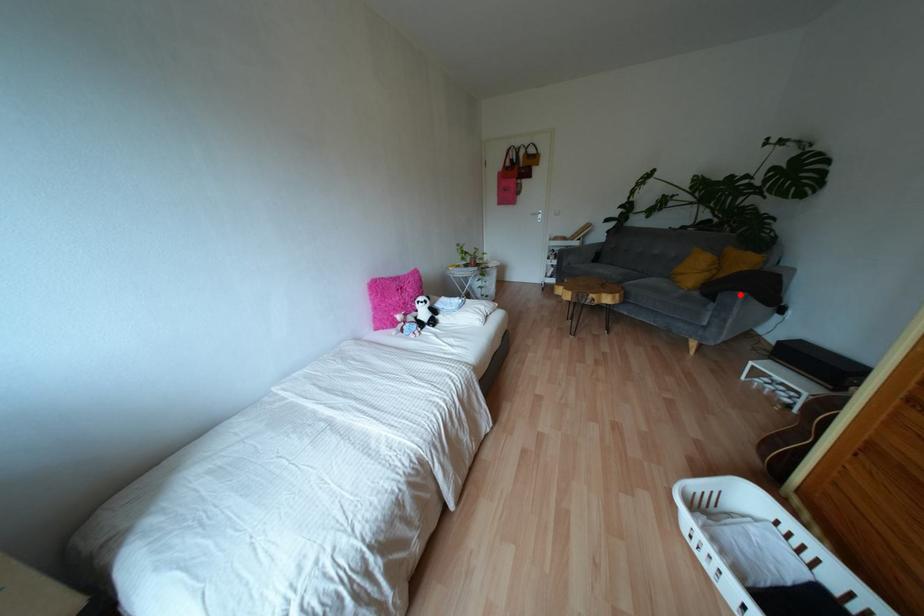
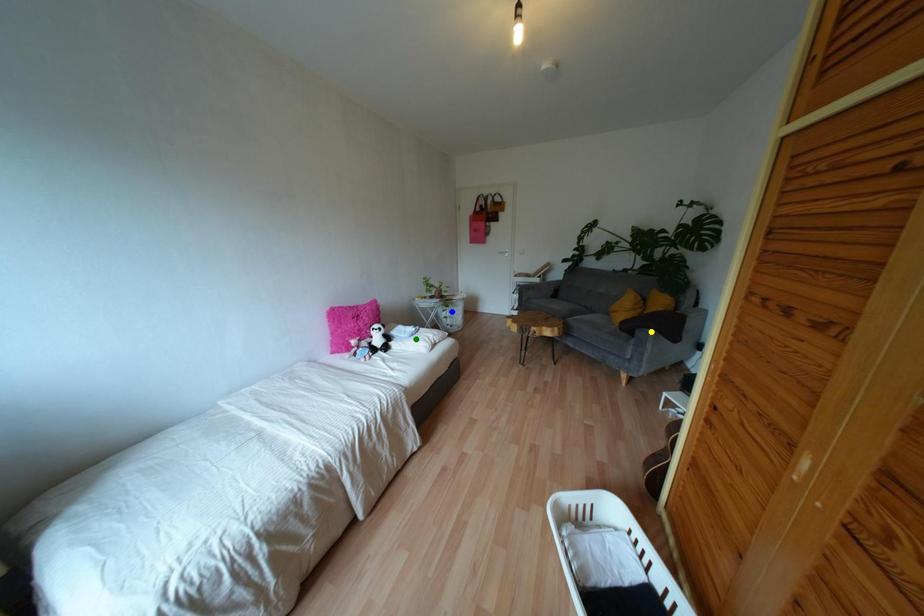
Question: I am providing you with two images of the same scene from different viewpoints. A red point is marked on the first image. You are given multiple points on the second image. Which point in image 2 represents the same 3d spot as the red point in image 1?

Choices:
 (A) blue point
 (B) green point
 (C) yellow point

Answer: (C)